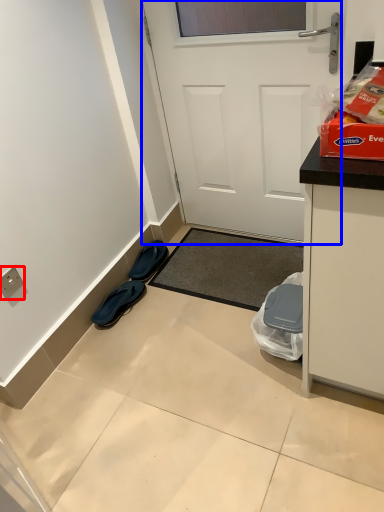
Question: Which object appears closest to the camera in this image, electric outlet (highlighted by a red box) or door (highlighted by a blue box)?

Choices:
 (A) electric outlet
 (B) door

Answer: (B)